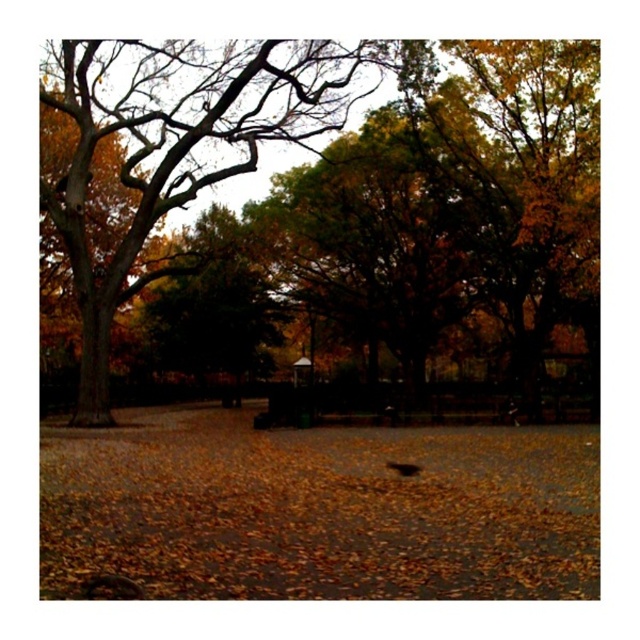
Which is above, brown leaf litter at center or golden textured tree at left?

golden textured tree at left is above.

Does point (531, 524) lie behind point (339, 68)?

No, (531, 524) is closer to viewer.

What do you see at coordinates (324, 513) in the screenshot? Image resolution: width=640 pixels, height=640 pixels. I see `brown leaf litter at center` at bounding box center [324, 513].

At what (x,y) coordinates should I click in order to perform the action: click on brown leaf litter at center. Please return your answer as a coordinate pair (x, y). Looking at the image, I should click on (324, 513).